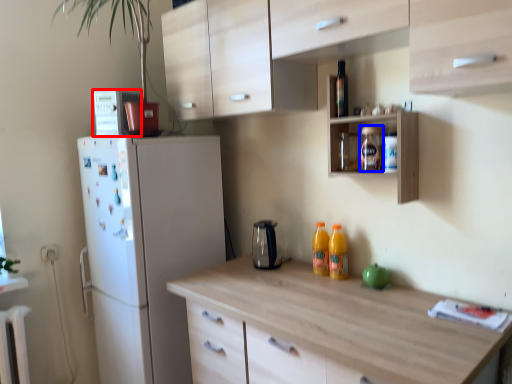
Question: Which of the following is the closest to the observer, appliance (highlighted by a red box) or bottle (highlighted by a blue box)?

Choices:
 (A) appliance
 (B) bottle

Answer: (B)